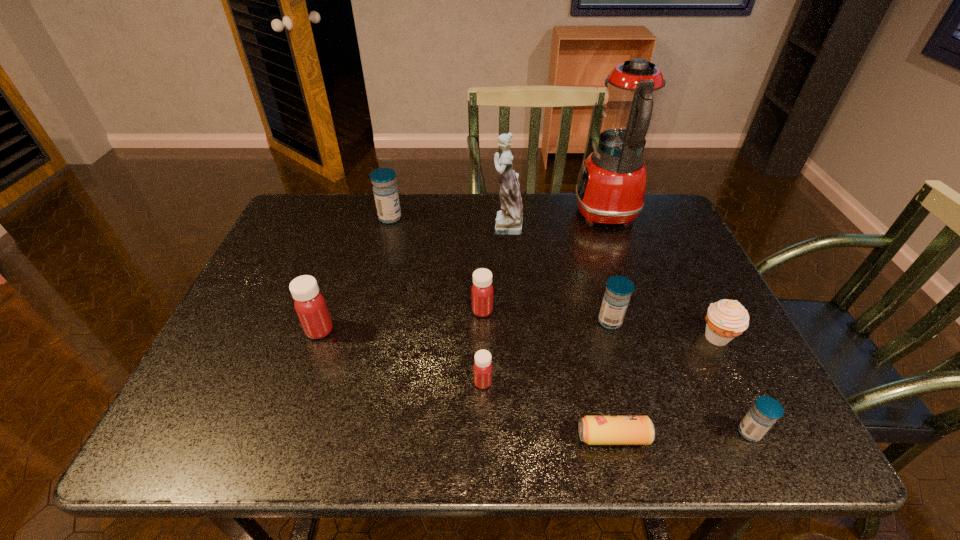
This screenshot has height=540, width=960. Identify the location of vacant space in between the biggest blue medicine and the muffin. (553, 278).

This screenshot has height=540, width=960. I want to click on vacant region between the beer can and the muffin, so click(665, 387).

Locate an element on the screen. This screenshot has width=960, height=540. blank region between the third nearest object and the beer can is located at coordinates (548, 410).

This screenshot has width=960, height=540. I want to click on the eighth closest object relative to the third nearest object, so click(x=611, y=187).

Where is `object that stands as the sixth closest to the eighth farthest object`? The image size is (960, 540). object that stands as the sixth closest to the eighth farthest object is located at coordinates (726, 319).

In order to click on medicine identified as the closest to the second blue medicine from right to left in this screenshot , I will do `click(482, 290)`.

This screenshot has height=540, width=960. What are the coordinates of `medicine that stands as the closest to the smallest red medicine` in the screenshot? It's located at (482, 290).

Locate an element on the screen. This screenshot has width=960, height=540. blue medicine that can be found as the second closest to the second smallest red medicine is located at coordinates (385, 190).

Choose which blue medicine is the third nearest neighbor to the muffin. Please provide its 2D coordinates. Your answer should be formatted as a tuple, i.e. [(x, y)], where the tuple contains the x and y coordinates of a point satisfying the conditions above.

[(385, 190)]

Where is `red medicine object that ranks as the closest to the second smallest red medicine`? Image resolution: width=960 pixels, height=540 pixels. red medicine object that ranks as the closest to the second smallest red medicine is located at coordinates (482, 369).